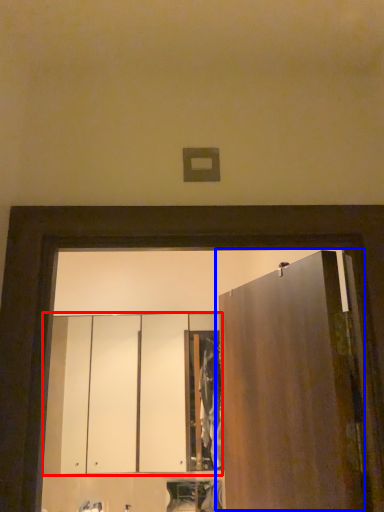
Question: Which of the following is the closest to the observer, cabinetry (highlighted by a red box) or door (highlighted by a blue box)?

Choices:
 (A) cabinetry
 (B) door

Answer: (B)